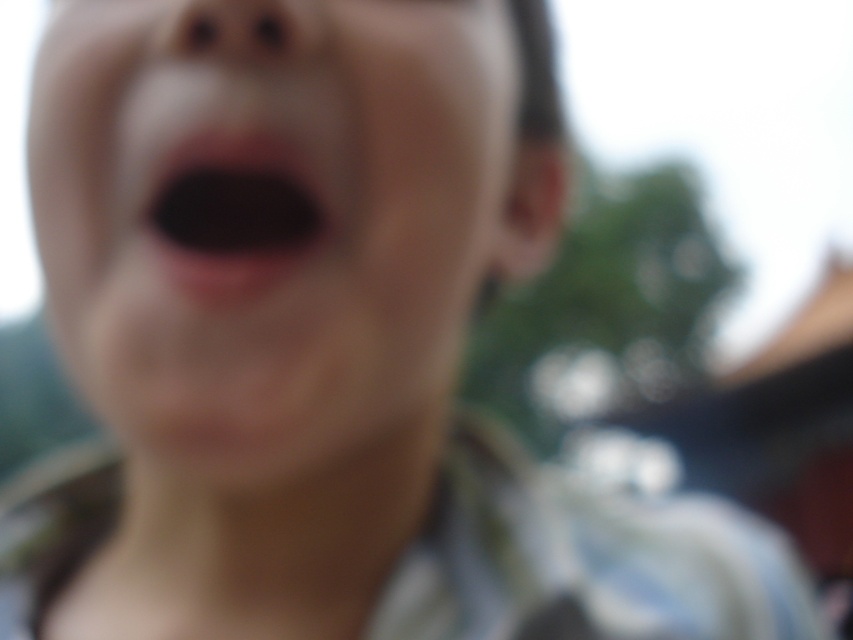
Question: Observing the image, what is the correct spatial positioning of smooth skin face at center in reference to black matte mouth at center?

Choices:
 (A) right
 (B) left

Answer: (A)

Question: Is smooth skin face at center in front of black matte mouth at center?

Choices:
 (A) no
 (B) yes

Answer: (B)

Question: Which point is closer to the camera?

Choices:
 (A) black matte mouth at center
 (B) smooth skin face at center

Answer: (B)

Question: Does smooth skin face at center have a larger size compared to black matte mouth at center?

Choices:
 (A) yes
 (B) no

Answer: (A)

Question: Which object appears closest to the camera in this image?

Choices:
 (A) black matte mouth at center
 (B) smooth skin face at center

Answer: (B)